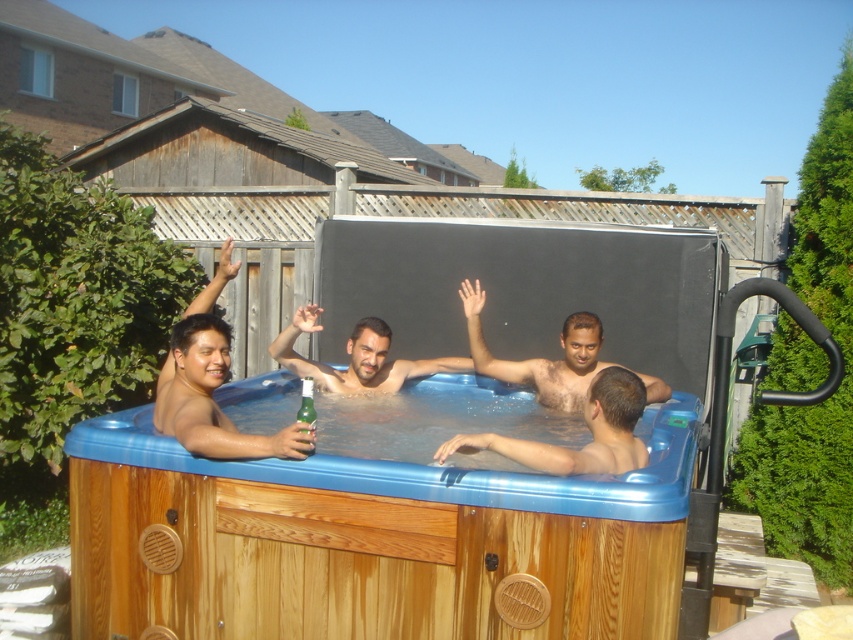
Question: Can you confirm if wooden hot tub at center is positioned to the left of brown skin at center?

Choices:
 (A) no
 (B) yes

Answer: (B)

Question: Estimate the real-world distances between objects in this image. Which object is closer to the brown skin at center?

Choices:
 (A) wooden hot tub at center
 (B) green matte bottle at center
 (C) matte blue hot tub at center

Answer: (C)

Question: Which point is closer to the camera taking this photo?

Choices:
 (A) (447, 358)
 (B) (492, 360)
 (C) (339, 429)
 (D) (444, 454)

Answer: (D)

Question: Is matte black man at left below green matte bottle at center?

Choices:
 (A) no
 (B) yes

Answer: (B)

Question: Which point is farther to the camera?

Choices:
 (A) click(579, 348)
 (B) click(312, 387)
 (C) click(515, 440)

Answer: (A)

Question: Can you confirm if matte black man at left is positioned below green matte bottle at center?

Choices:
 (A) no
 (B) yes

Answer: (B)